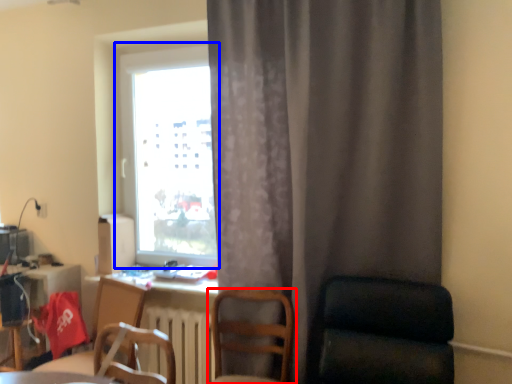
Question: Which of the following is the farthest to the observer, chair (highlighted by a red box) or window (highlighted by a blue box)?

Choices:
 (A) chair
 (B) window

Answer: (B)